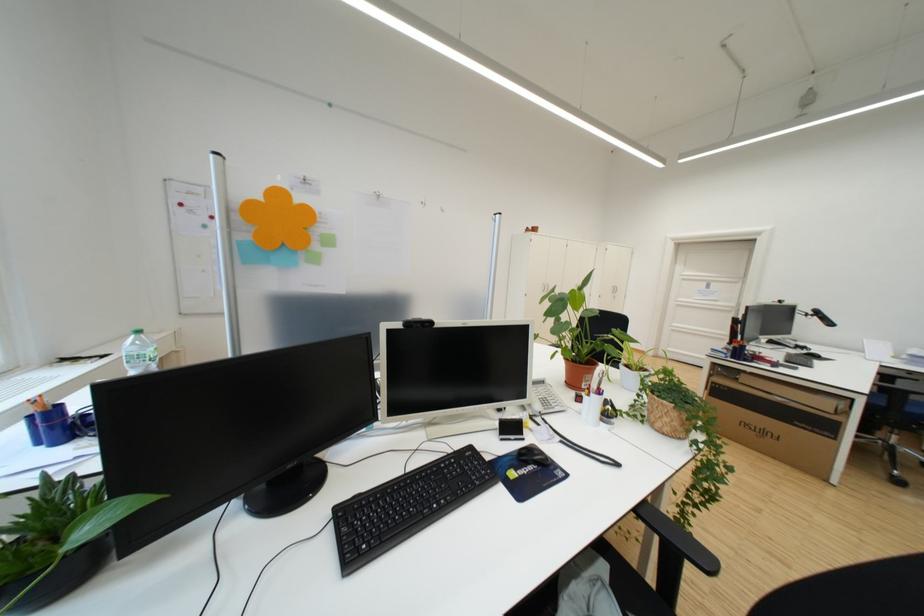
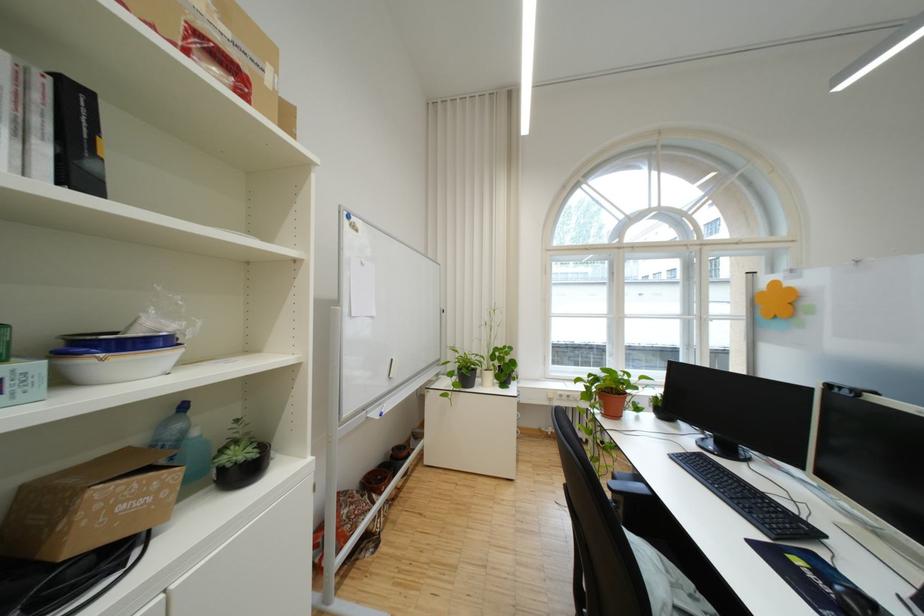
In the second image, find the point that corresponds to point (542, 469) in the first image.

(841, 592)